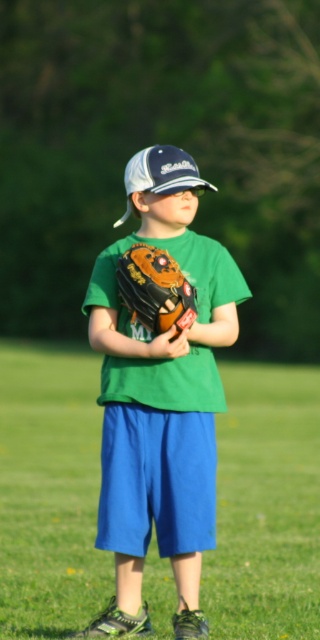
Between point (234, 380) and point (175, 326), which one is positioned in front?

Point (175, 326) is more forward.

Does green grass at center come in front of brown leather glove at center?

Yes, green grass at center is in front of brown leather glove at center.

Who is more forward, (x=232, y=442) or (x=94, y=344)?

Point (x=94, y=344) is in front.

Find the location of `green grass at center`. green grass at center is located at coordinates (49, 493).

Who is higher up, white matte baseball cap at center or brown leather glove at center?

white matte baseball cap at center is above.

Does white matte baseball cap at center appear on the right side of brown leather glove at center?

No, white matte baseball cap at center is not to the right of brown leather glove at center.

The height and width of the screenshot is (640, 320). Find the location of `white matte baseball cap at center`. white matte baseball cap at center is located at coordinates (160, 173).

Where is `white matte baseball cap at center`? white matte baseball cap at center is located at coordinates (160, 173).

Is brown leather baseball glove at center wider than white matte baseball cap at center?

No, brown leather baseball glove at center is not wider than white matte baseball cap at center.

Is brown leather baseball glove at center to the right of white matte baseball cap at center from the viewer's perspective?

Indeed, brown leather baseball glove at center is positioned on the right side of white matte baseball cap at center.

Is point (186, 296) closer to viewer compared to point (169, 177)?

Yes.

At what (x,y) coordinates should I click in order to perform the action: click on brown leather baseball glove at center. Please return your answer as a coordinate pair (x, y). Looking at the image, I should click on (154, 289).